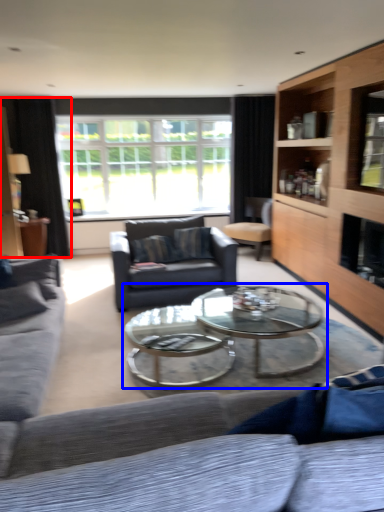
Question: Which object appears farthest to the camera in this image, curtain (highlighted by a red box) or coffee table (highlighted by a blue box)?

Choices:
 (A) curtain
 (B) coffee table

Answer: (A)